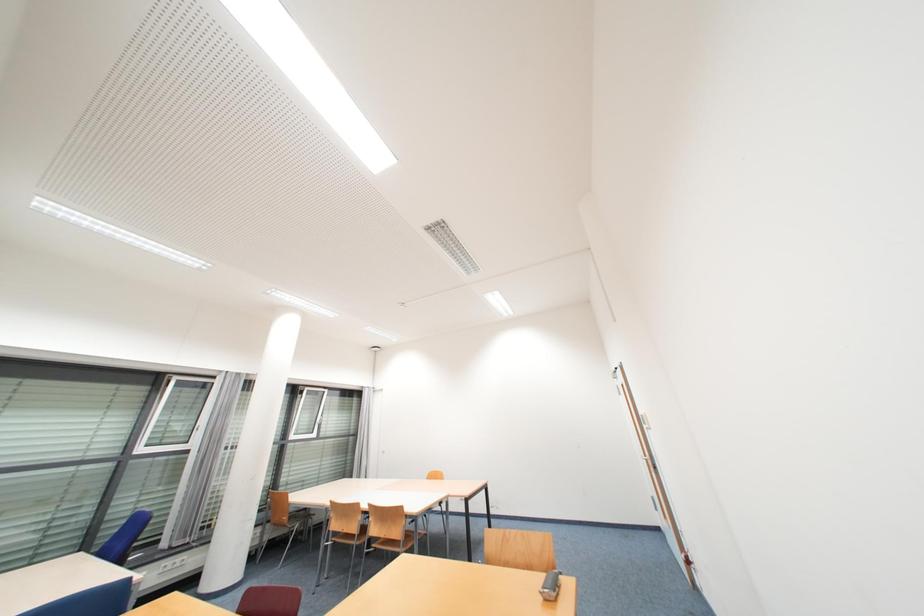
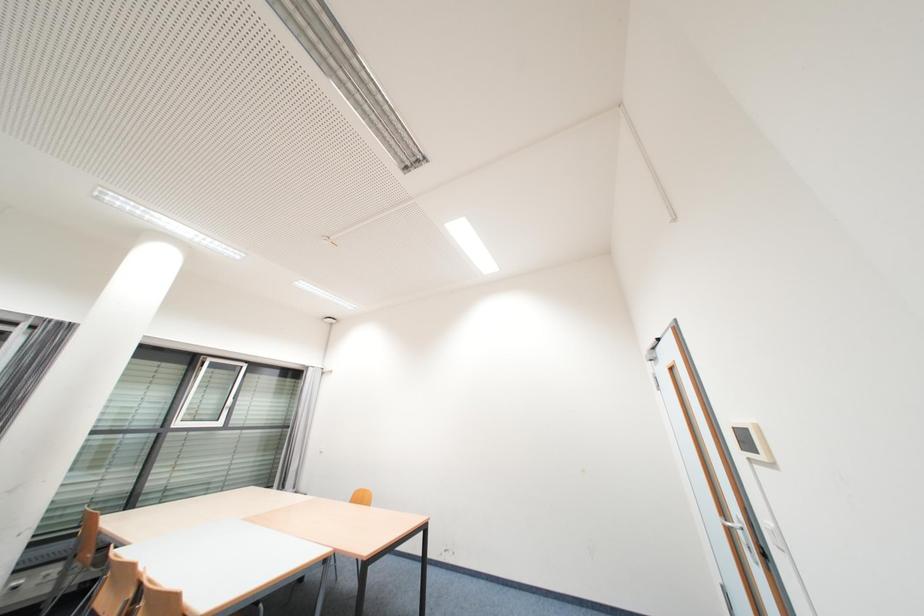
What movement of the cameraman would produce the second image?

The movement direction of the cameraman is right, forward.